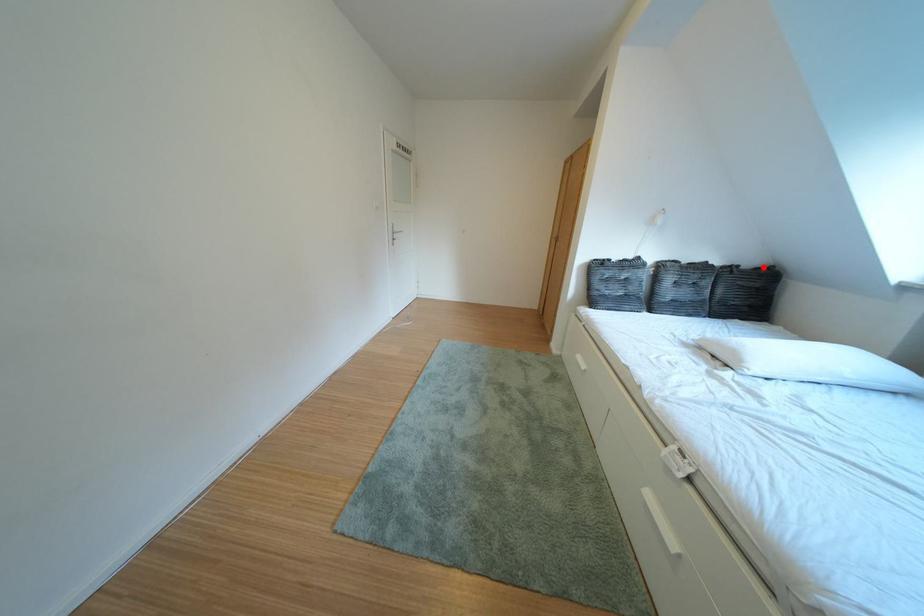
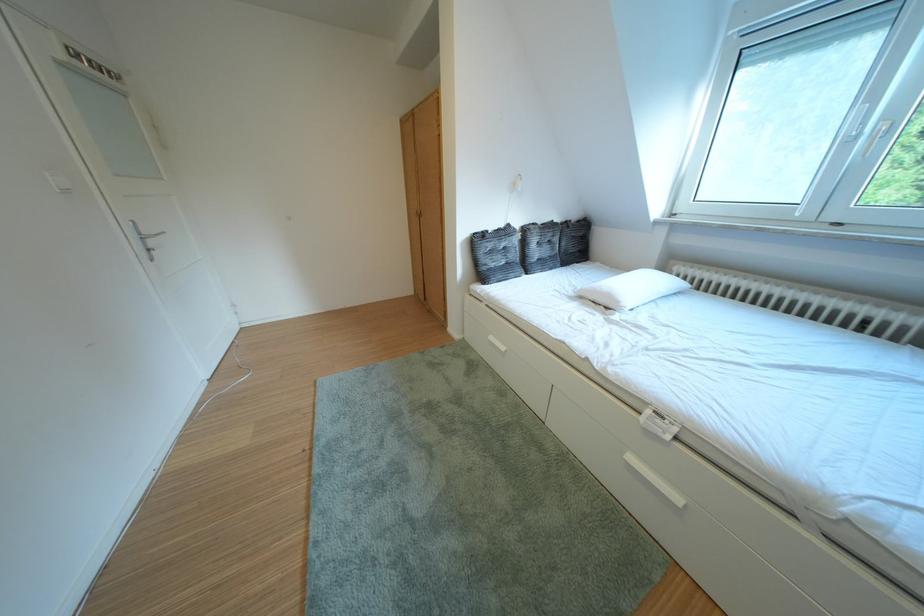
Question: A red point is marked in image1. In image2, is the corresponding 3D point closer to the camera or farther? Reply with the corresponding letter.

Choices:
 (A) The corresponding 3D point is closer.
 (B) The corresponding 3D point is farther.

Answer: (A)